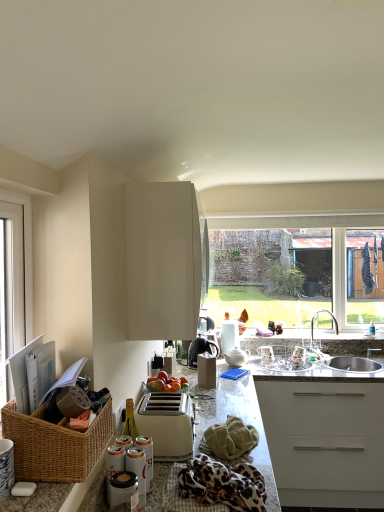
Question: Is granite countertop at center located within green textured towel at lower center?

Choices:
 (A) yes
 (B) no

Answer: (B)

Question: Is green textured towel at lower center positioned beyond the bounds of granite countertop at center?

Choices:
 (A) no
 (B) yes

Answer: (A)

Question: Can you confirm if green textured towel at lower center is wider than granite countertop at center?

Choices:
 (A) yes
 (B) no

Answer: (B)

Question: From the image's perspective, is green textured towel at lower center over granite countertop at center?

Choices:
 (A) no
 (B) yes

Answer: (B)

Question: Can you confirm if green textured towel at lower center is shorter than granite countertop at center?

Choices:
 (A) no
 (B) yes

Answer: (B)

Question: Considering the positions of point (140, 492) and point (311, 324), is point (140, 492) closer or farther from the camera than point (311, 324)?

Choices:
 (A) closer
 (B) farther

Answer: (A)

Question: From the image's perspective, relative to satin nickel faucet at sink right, is metallic silver can at lower center, which is the third appliance in back-to-front order, above or below?

Choices:
 (A) below
 (B) above

Answer: (A)

Question: Which is correct: metallic silver can at lower center, which is the third appliance in back-to-front order, is inside satin nickel faucet at sink right, or outside of it?

Choices:
 (A) outside
 (B) inside

Answer: (A)

Question: Is metallic silver can at lower center, marked as the 3th appliance in a right-to-left arrangement, taller or shorter than satin nickel faucet at sink right?

Choices:
 (A) short
 (B) tall

Answer: (A)

Question: In terms of height, does white plastic window at left look taller or shorter compared to white ceramic teapot at center, positioned as the 3th appliance in front-to-back order?

Choices:
 (A) tall
 (B) short

Answer: (A)

Question: Is white plastic window at left inside the boundaries of white ceramic teapot at center, positioned as the 3th appliance in front-to-back order, or outside?

Choices:
 (A) outside
 (B) inside

Answer: (A)

Question: In terms of width, does white plastic window at left look wider or thinner when compared to white ceramic teapot at center, positioned as the 3th appliance in front-to-back order?

Choices:
 (A) wide
 (B) thin

Answer: (B)

Question: In the image, is white plastic window at left positioned in front of or behind white ceramic teapot at center, positioned as the 3th appliance in front-to-back order?

Choices:
 (A) front
 (B) behind

Answer: (A)

Question: From their relative heights in the image, would you say white plastic toaster at center is taller or shorter than metallic silver can at lower center, marked as the 3th appliance in a right-to-left arrangement?

Choices:
 (A) tall
 (B) short

Answer: (A)

Question: Is point (178, 458) positioned closer to the camera than point (139, 501)?

Choices:
 (A) farther
 (B) closer

Answer: (A)